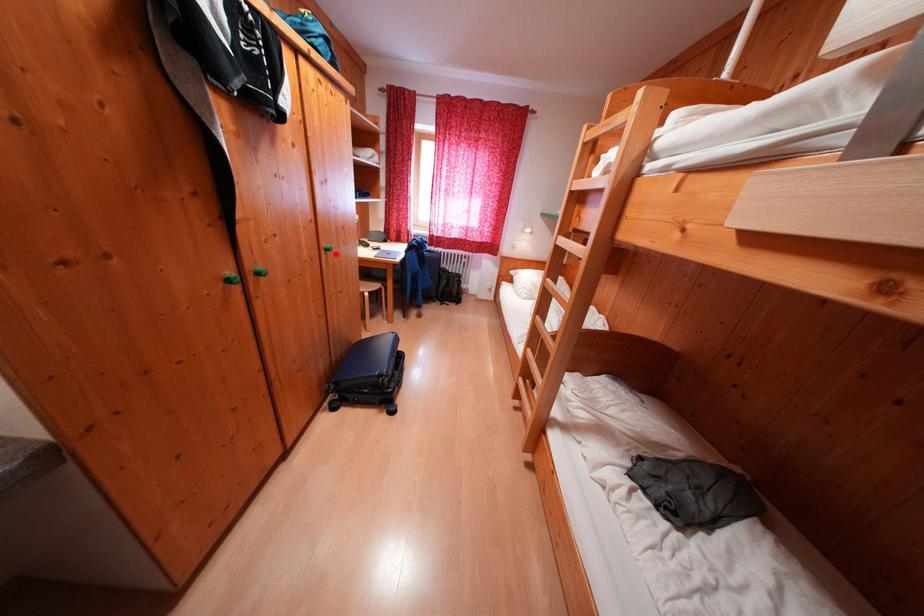
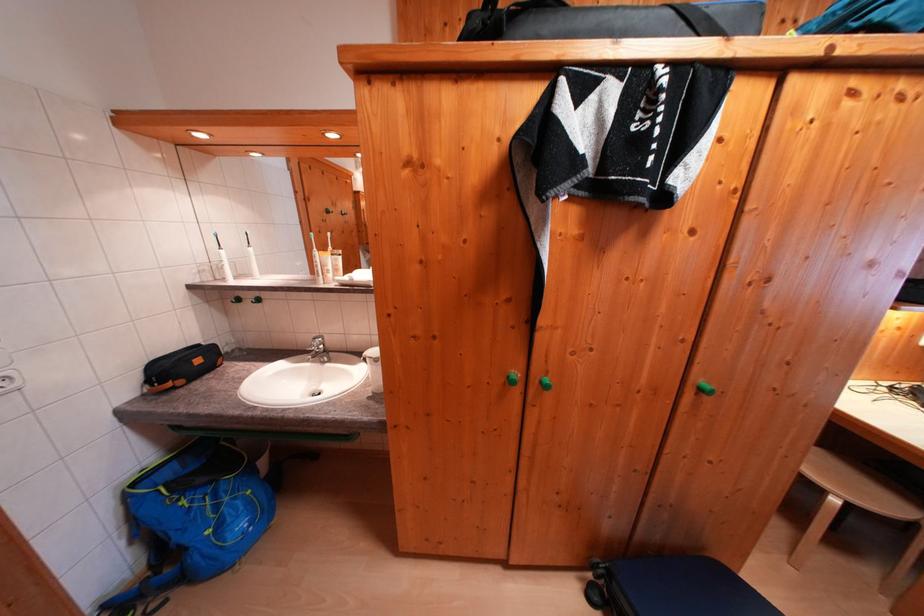
Question: I am providing you with two images of the same scene from different viewpoints. A red point is shown in image1. For the corresponding object point in image2, is it positioned nearer or farther from the camera?

Choices:
 (A) Nearer
 (B) Farther

Answer: (B)